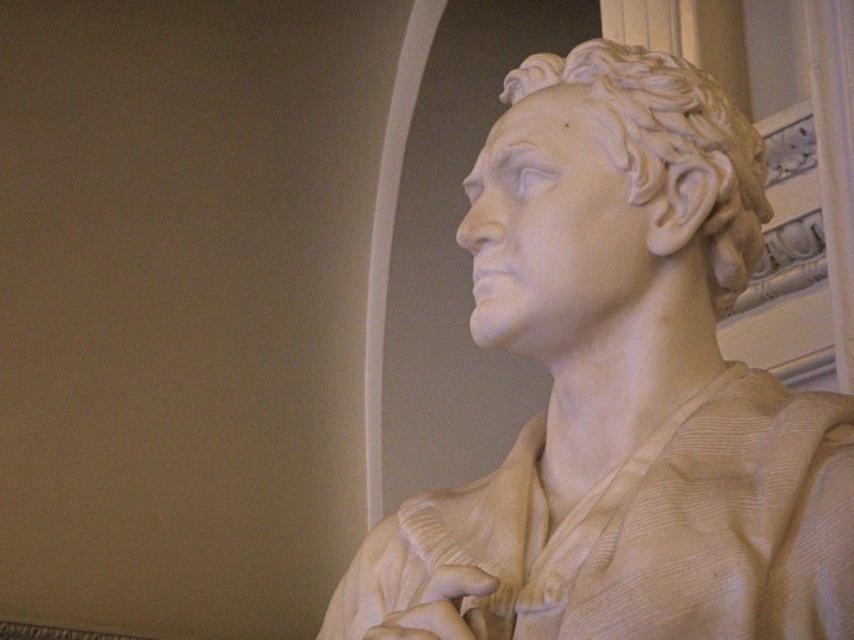
Consider the image. You are an art student standing in front of the classical marble bust sculpture. You need to sketch the bust from the left side. Given the position of the white marble bust at right, can you determine if the bust is positioned to your right or left side?

The white marble bust at right is positioned at coordinates point (623,390), which places it to the right side of the observer. Therefore, to sketch the bust from the left side, you would need to move to its left, which is your right side.

You are an art student analyzing the classical marble sculpture. You notice the white marble bust at right and the white marble head at center. Which object is taller?

The white marble bust at right is much taller than the white marble head at center.

You are an art conservator standing at a distance of 60 feet from the white marble bust at right. You need to reach it to perform maintenance. Can you walk straight towards it without moving your current position? Explain why or why not based on the distance provided.

The white marble bust at right is 63.15 feet from the camera. Since you are currently 60 feet away, you need to walk an additional 3.15 feet forward to reach it.